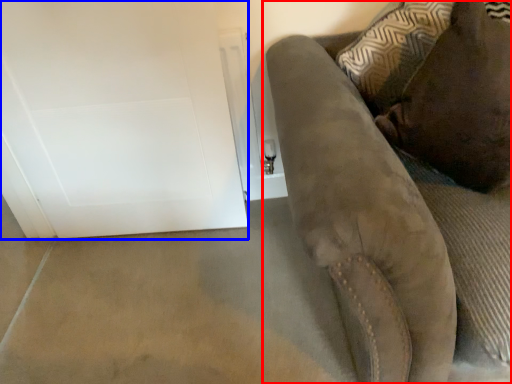
Question: Which point is closer to the camera, furniture (highlighted by a red box) or glass door (highlighted by a blue box)?

Choices:
 (A) furniture
 (B) glass door

Answer: (A)